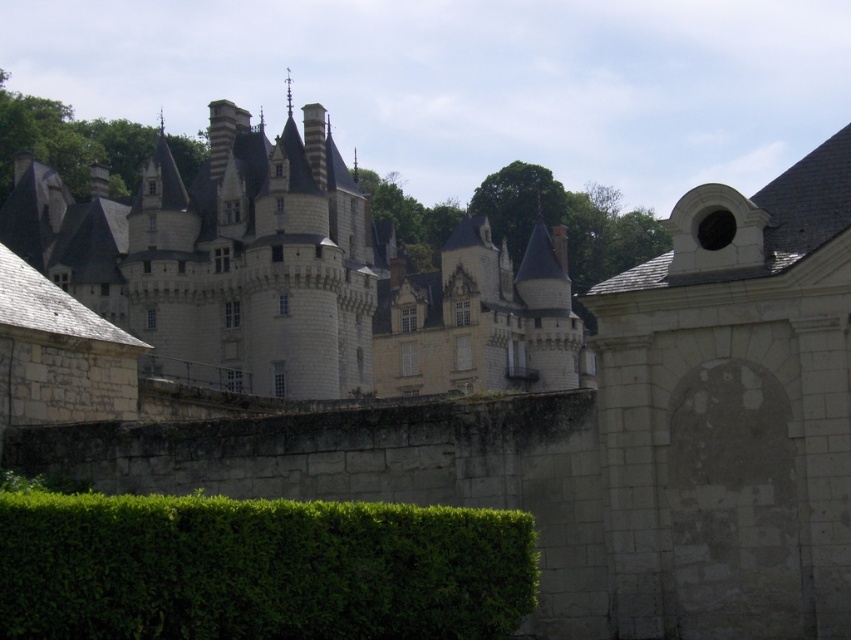
You are a drone operator planning to fly a drone over the white stone castle at center and the green leafy hedge at lower left. Which object will require you to adjust your drone to a higher altitude to capture a full view?

The white stone castle at center is much taller than the green leafy hedge at lower left, so you will need to adjust your drone to a higher altitude to capture a full view of the white stone castle at center.

You are standing in a garden and see the white stone castle at center and the green leafy hedge at lower left. Which object is closer to you?

The green leafy hedge at lower left is closer to you because it is positioned below the white stone castle at center, indicating it is in the foreground of the image.